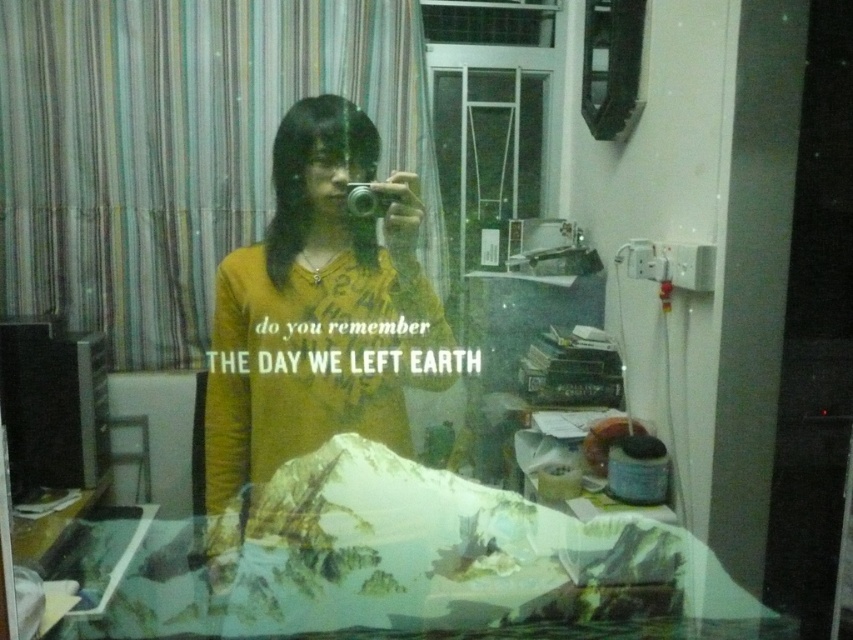
Question: Does yellow matte shirt at center come in front of matte black camera at center?

Choices:
 (A) no
 (B) yes

Answer: (B)

Question: Which point is farther to the camera?

Choices:
 (A) (292, 260)
 (B) (396, 198)

Answer: (A)

Question: Which object appears farthest from the camera in this image?

Choices:
 (A) yellow matte shirt at center
 (B) matte black camera at center

Answer: (B)

Question: Which object is farther from the camera taking this photo?

Choices:
 (A) yellow matte shirt at center
 (B) matte black camera at center

Answer: (B)

Question: Does yellow matte shirt at center appear under matte black camera at center?

Choices:
 (A) no
 (B) yes

Answer: (B)

Question: Does yellow matte shirt at center have a larger size compared to matte black camera at center?

Choices:
 (A) yes
 (B) no

Answer: (A)